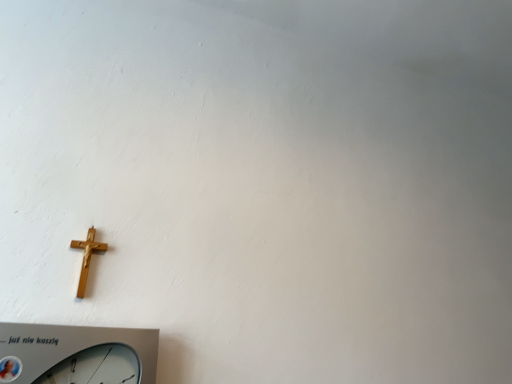
Question: Is gold wooden crucifix at lower left outside silver metallic wall clock at lower left?

Choices:
 (A) no
 (B) yes

Answer: (B)

Question: Is gold wooden crucifix at lower left at the right side of silver metallic wall clock at lower left?

Choices:
 (A) no
 (B) yes

Answer: (A)

Question: Can you confirm if gold wooden crucifix at lower left is wider than silver metallic wall clock at lower left?

Choices:
 (A) no
 (B) yes

Answer: (A)

Question: Is gold wooden crucifix at lower left facing towards silver metallic wall clock at lower left?

Choices:
 (A) no
 (B) yes

Answer: (A)

Question: Would you consider gold wooden crucifix at lower left to be distant from silver metallic wall clock at lower left?

Choices:
 (A) yes
 (B) no

Answer: (B)

Question: Is gold wooden crucifix at lower left taller than silver metallic wall clock at lower left?

Choices:
 (A) no
 (B) yes

Answer: (A)

Question: Is silver metallic wall clock at lower left facing away from gold wooden crucifix at lower left?

Choices:
 (A) yes
 (B) no

Answer: (B)

Question: Considering the relative sizes of silver metallic wall clock at lower left and gold wooden crucifix at lower left in the image provided, is silver metallic wall clock at lower left smaller than gold wooden crucifix at lower left?

Choices:
 (A) yes
 (B) no

Answer: (B)

Question: Considering the relative sizes of silver metallic wall clock at lower left and gold wooden crucifix at lower left in the image provided, is silver metallic wall clock at lower left wider than gold wooden crucifix at lower left?

Choices:
 (A) no
 (B) yes

Answer: (B)

Question: Is silver metallic wall clock at lower left directly adjacent to gold wooden crucifix at lower left?

Choices:
 (A) yes
 (B) no

Answer: (B)

Question: Does silver metallic wall clock at lower left have a lesser width compared to gold wooden crucifix at lower left?

Choices:
 (A) yes
 (B) no

Answer: (B)

Question: Is silver metallic wall clock at lower left bigger than gold wooden crucifix at lower left?

Choices:
 (A) yes
 (B) no

Answer: (A)

Question: Considering the positions of gold wooden crucifix at lower left and silver metallic wall clock at lower left in the image, is gold wooden crucifix at lower left taller or shorter than silver metallic wall clock at lower left?

Choices:
 (A) short
 (B) tall

Answer: (A)